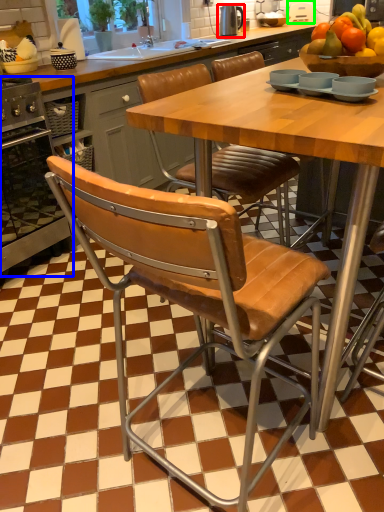
Question: Based on their relative distances, which object is farther from appliance (highlighted by a red box)? Choose from oven (highlighted by a blue box) and appliance (highlighted by a green box).

Choices:
 (A) oven
 (B) appliance

Answer: (A)